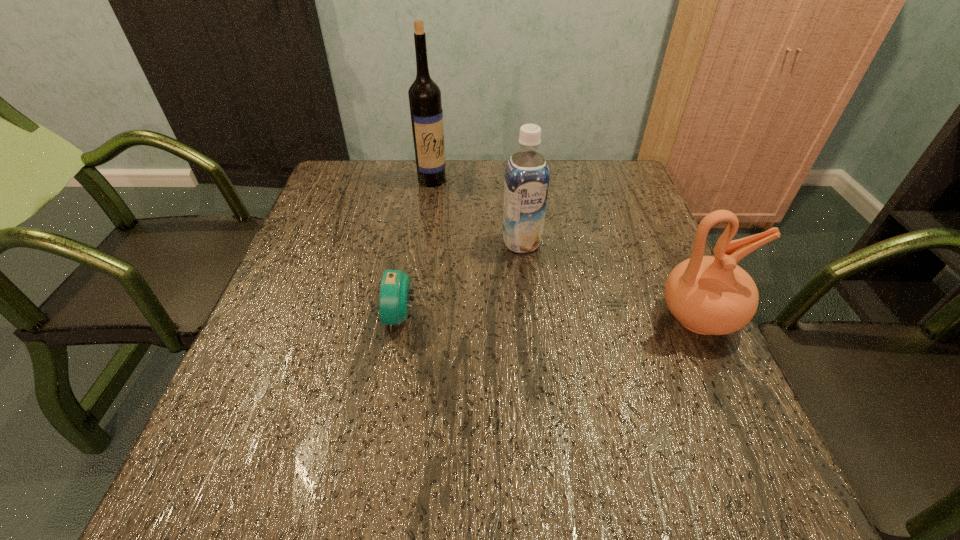
At what (x,y) coordinates should I click in order to perform the action: click on free space on the desktop that is between the shortest object and the pottery and is positioned on the label of the farthest object. Please return your answer as a coordinate pair (x, y). This screenshot has height=540, width=960. Looking at the image, I should click on (526, 317).

I want to click on free space on the desktop that is between the alarm clock and the rightmost object and is positioned on the label of the soya milk, so click(547, 318).